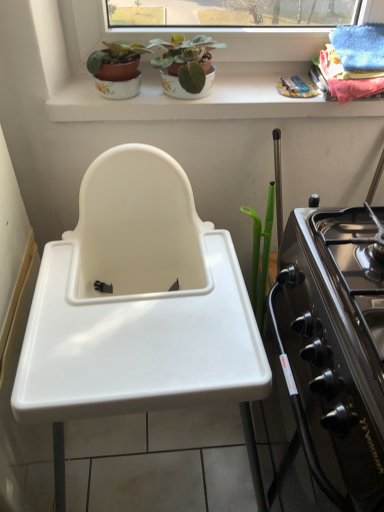
Question: From the image's perspective, is white ceramic window sill at upper center over black glossy oven at right?

Choices:
 (A) yes
 (B) no

Answer: (A)

Question: Are white ceramic window sill at upper center and black glossy oven at right beside each other?

Choices:
 (A) no
 (B) yes

Answer: (A)

Question: Is white ceramic window sill at upper center smaller than black glossy oven at right?

Choices:
 (A) yes
 (B) no

Answer: (A)

Question: Does white ceramic window sill at upper center have a lesser height compared to black glossy oven at right?

Choices:
 (A) no
 (B) yes

Answer: (B)

Question: Is white ceramic window sill at upper center further to camera compared to black glossy oven at right?

Choices:
 (A) no
 (B) yes

Answer: (B)

Question: Does white ceramic window sill at upper center have a greater height compared to black glossy oven at right?

Choices:
 (A) no
 (B) yes

Answer: (A)

Question: Does white plastic sink at center have a greater width compared to white ceramic window sill at upper center?

Choices:
 (A) no
 (B) yes

Answer: (B)

Question: Is white plastic sink at center facing away from white ceramic window sill at upper center?

Choices:
 (A) yes
 (B) no

Answer: (A)

Question: From the image's perspective, is white plastic sink at center located beneath white ceramic window sill at upper center?

Choices:
 (A) yes
 (B) no

Answer: (A)

Question: Are white plastic sink at center and white ceramic window sill at upper center located far from each other?

Choices:
 (A) no
 (B) yes

Answer: (A)

Question: Are white plastic sink at center and white ceramic window sill at upper center making contact?

Choices:
 (A) no
 (B) yes

Answer: (A)

Question: From a real-world perspective, is white plastic sink at center located higher than white ceramic window sill at upper center?

Choices:
 (A) yes
 (B) no

Answer: (B)

Question: Is white plastic sink at center outside black glossy oven at right?

Choices:
 (A) yes
 (B) no

Answer: (A)